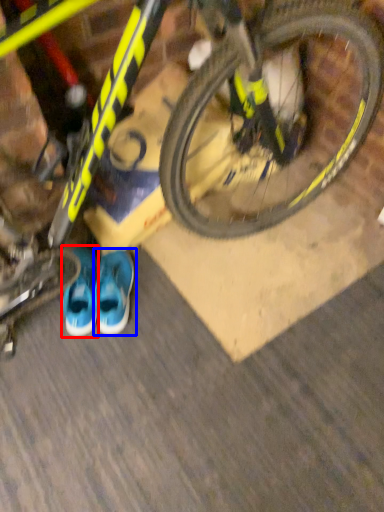
Question: Among these objects, which one is nearest to the camera, footwear (highlighted by a red box) or running shoe (highlighted by a blue box)?

Choices:
 (A) footwear
 (B) running shoe

Answer: (B)